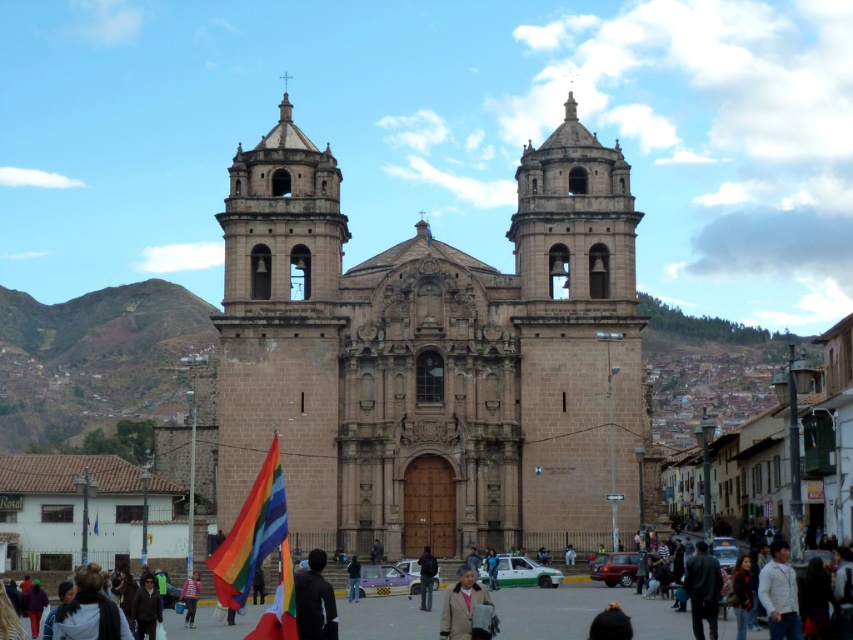
You are standing in front of the brown stone church at center and want to place a dark brown leather jacket at lower right near the entrance. Based on the scene description, can you determine if the jacket will be visible from the front of the church?

The brown stone church at center is located above the dark brown leather jacket at lower right, meaning the jacket is positioned lower down near the base of the church. Since the jacket is at lower right, it should be visible from the front of the church as it is placed near the entrance area.